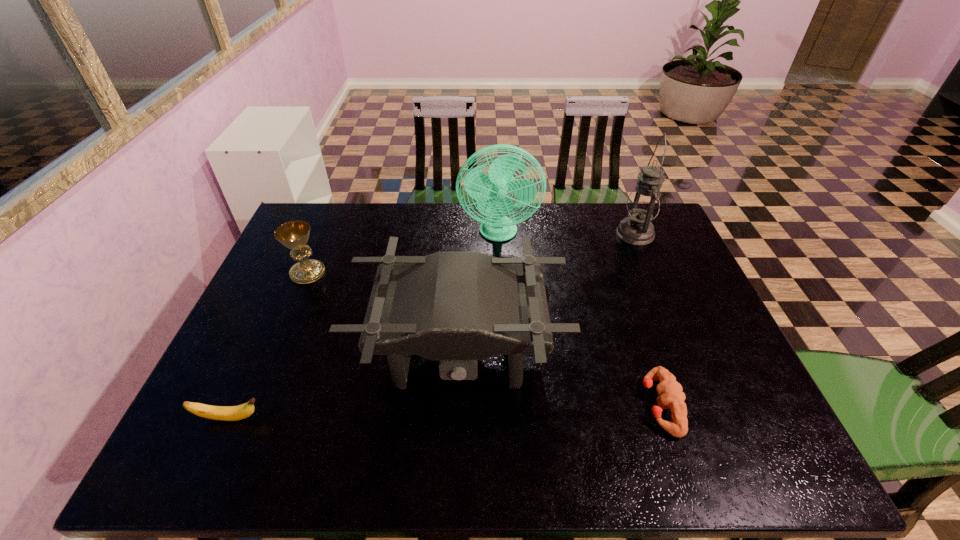
You are a GUI agent. You are given a task and a screenshot of the screen. Output one action in this format:
    pyautogui.click(x=<x>, y=<y>)
    Task: Click on the free space between the rightmost object and the shortest object
    
    Given the screenshot: What is the action you would take?
    pyautogui.click(x=647, y=319)

What are the coordinates of `unoccupied position between the fan and the fifth object from left to right` in the screenshot? It's located at (579, 320).

Locate which object ranks third in proximity to the second shortest object. Please provide its 2D coordinates. Your answer should be formatted as a tuple, i.e. [(x, y)], where the tuple contains the x and y coordinates of a point satisfying the conditions above.

[(490, 191)]

Identify which object is the fifth nearest to the banana. Please provide its 2D coordinates. Your answer should be formatted as a tuple, i.e. [(x, y)], where the tuple contains the x and y coordinates of a point satisfying the conditions above.

[(643, 204)]

This screenshot has width=960, height=540. I want to click on free space that satisfies the following two spatial constraints: 1. in front of the fan to blow air; 2. at the stem of the banana, so click(x=508, y=418).